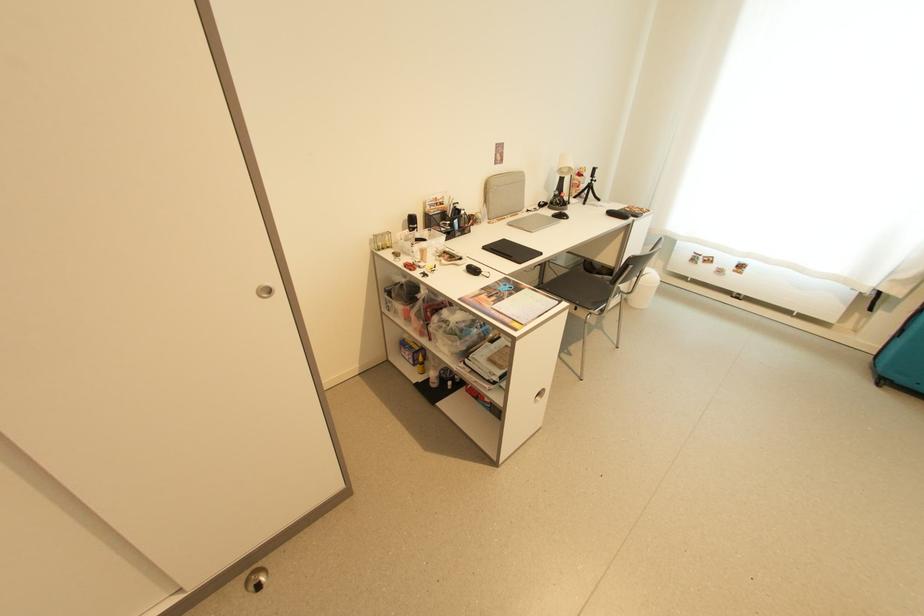
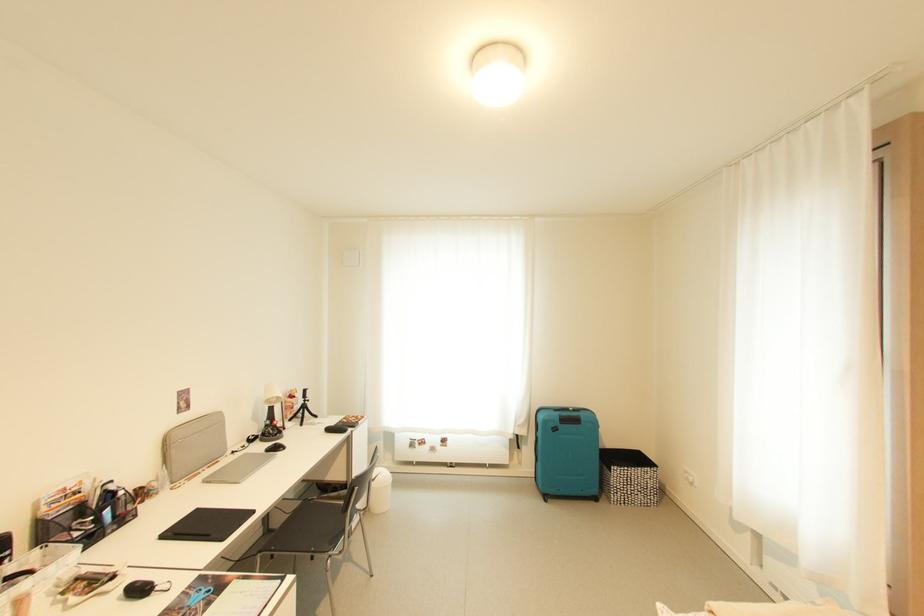
First-person continuous shooting, in which direction is the camera rotating?

The rotation direction of the camera is right-up.